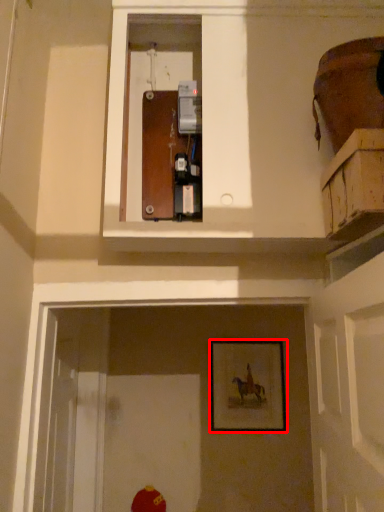
Question: From the image's perspective, what is the correct spatial relationship of picture frame (annotated by the red box) in relation to cabinetry?

Choices:
 (A) below
 (B) above

Answer: (A)